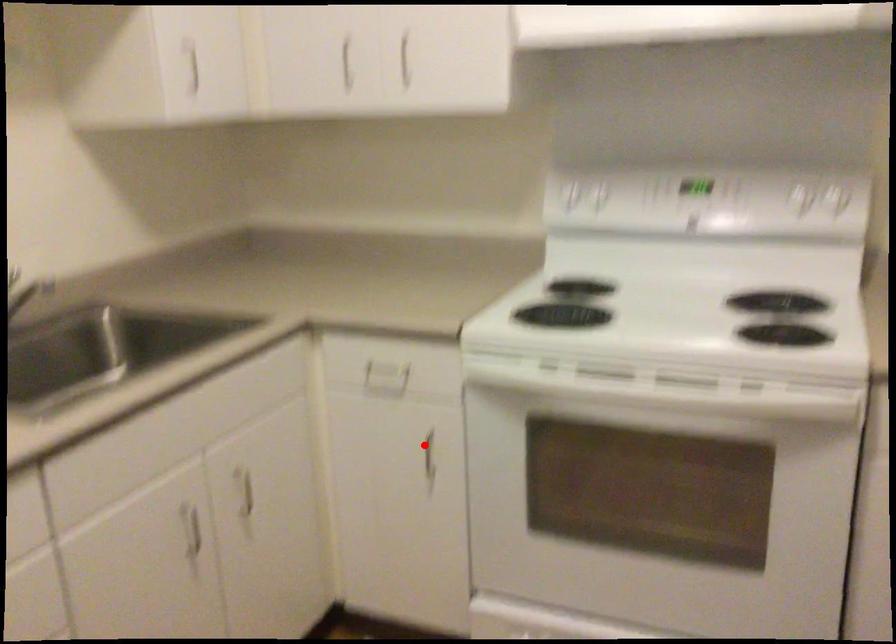
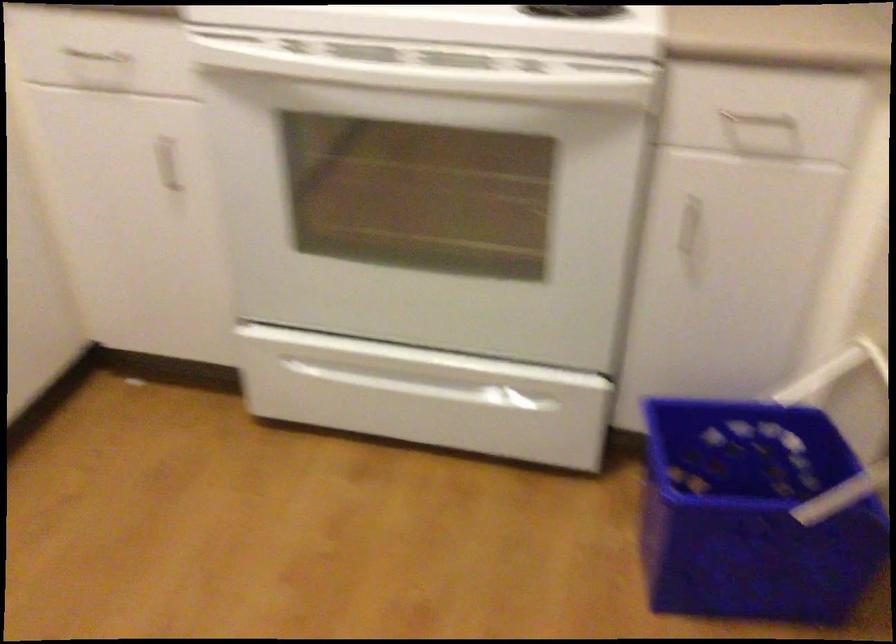
Question: I am providing you with two images of the same scene from different viewpoints. A red point is shown in image1. For the corresponding object point in image2, is it positioned nearer or farther from the camera?

Choices:
 (A) Nearer
 (B) Farther

Answer: (A)